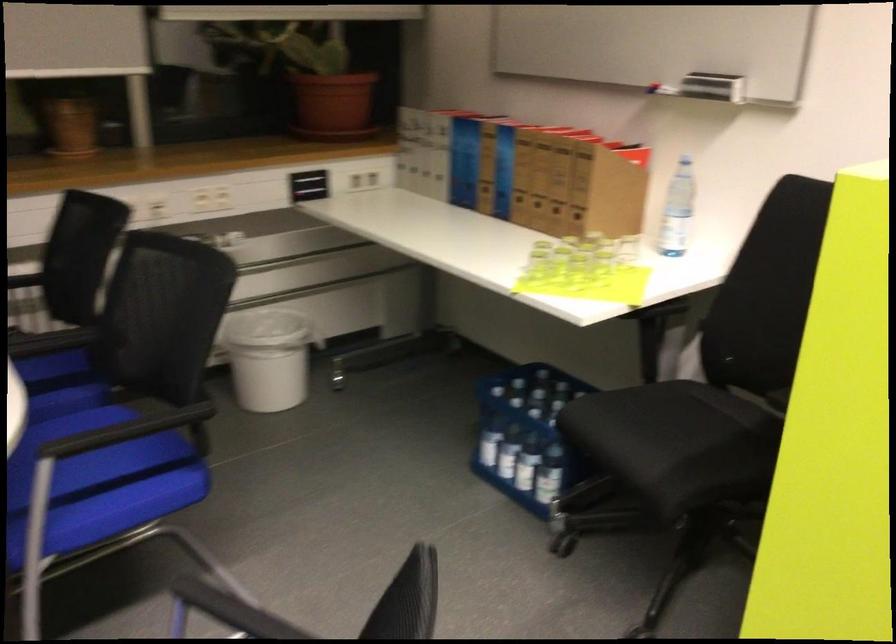
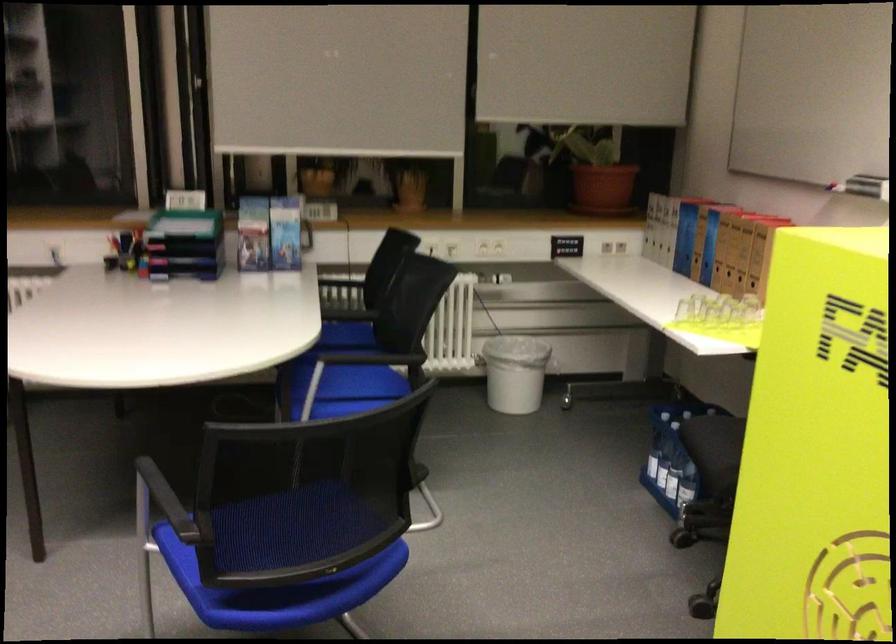
In the second image, find the point that corresponds to point 463,167 in the first image.

(685, 238)